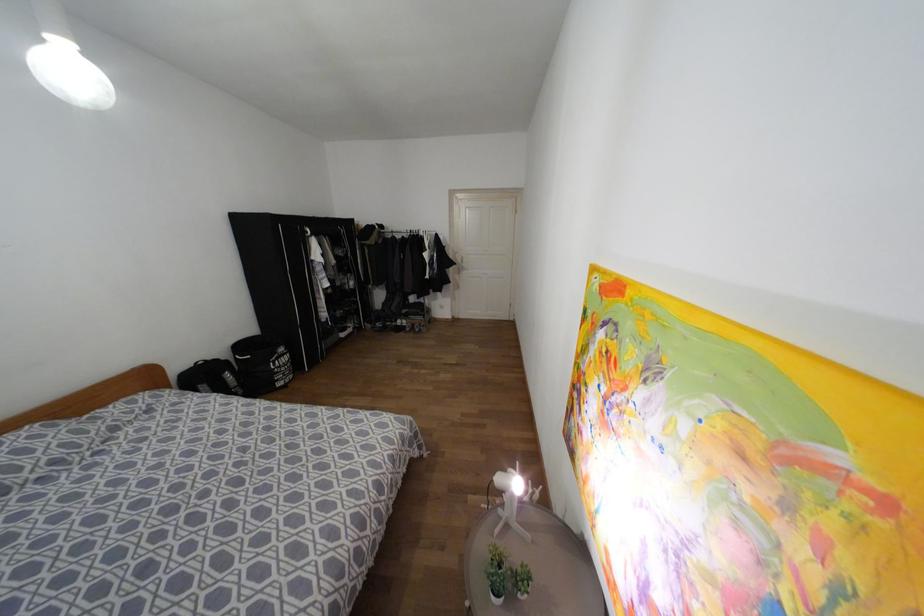
Which object does [513,498] point to?

It corresponds to the white desk lamp in the image.